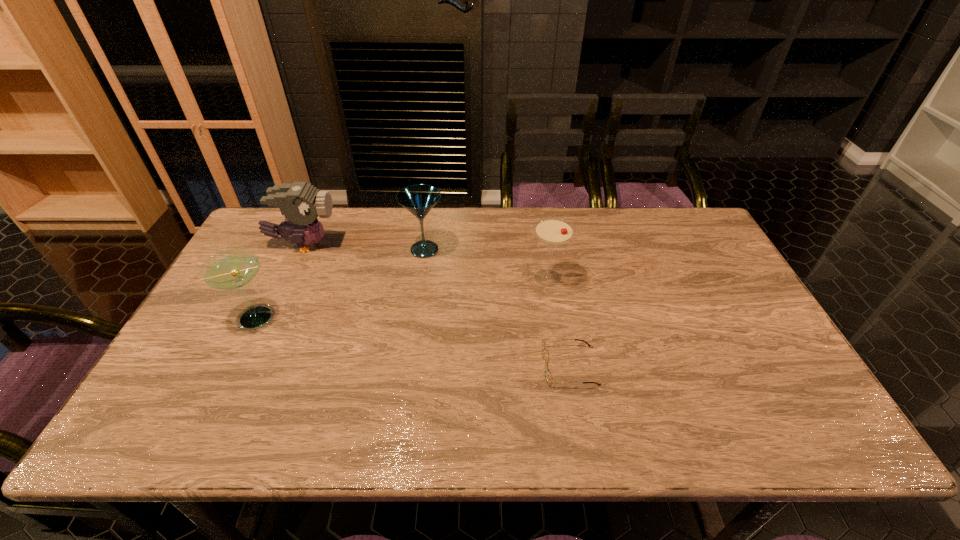
This screenshot has height=540, width=960. Identify the location of object at the far left corner. (300, 202).

In the image, there is a desktop. Identify the location of blank space at the far edge. (470, 207).

Image resolution: width=960 pixels, height=540 pixels. Find the location of `blank space at the near edge of the desktop`. blank space at the near edge of the desktop is located at coordinates (x=666, y=409).

Where is `vacant space at the right edge of the desktop`? Image resolution: width=960 pixels, height=540 pixels. vacant space at the right edge of the desktop is located at coordinates (744, 406).

The image size is (960, 540). Identify the location of vacant region between the leftmost martini and the farthest martini. (341, 284).

This screenshot has width=960, height=540. What are the coordinates of `blank region between the farthest martini and the rightmost martini` in the screenshot? It's located at (486, 264).

Identify the location of empty space between the rightmost martini and the nearest object. This screenshot has height=540, width=960. (559, 322).

Locate an element on the screen. The image size is (960, 540). free spot between the farthest martini and the bird is located at coordinates (364, 247).

Where is `unoccupied position between the second farthest martini and the third object from left to right`? The image size is (960, 540). unoccupied position between the second farthest martini and the third object from left to right is located at coordinates (486, 264).

The width and height of the screenshot is (960, 540). Find the location of `free spot between the shortest object and the bird`. free spot between the shortest object and the bird is located at coordinates (437, 306).